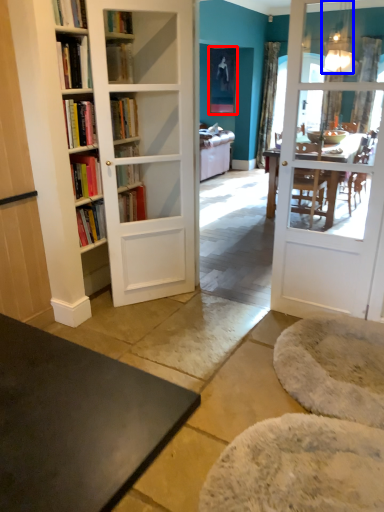
Question: Which of the following is the closest to the observer, picture frame (highlighted by a red box) or lamp (highlighted by a blue box)?

Choices:
 (A) picture frame
 (B) lamp

Answer: (B)